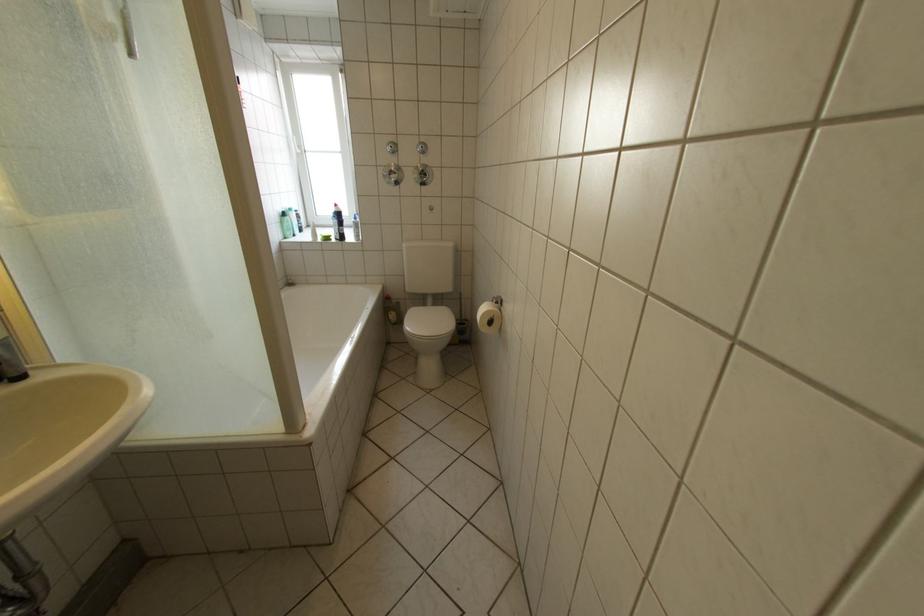
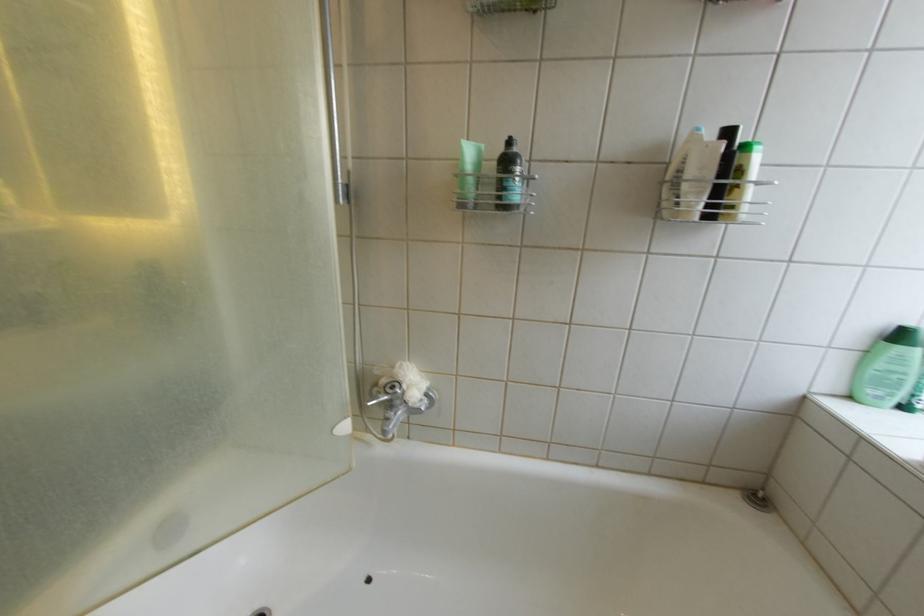
Find the pixel in the second image that matches the point at 300,223 in the first image.

(914, 361)